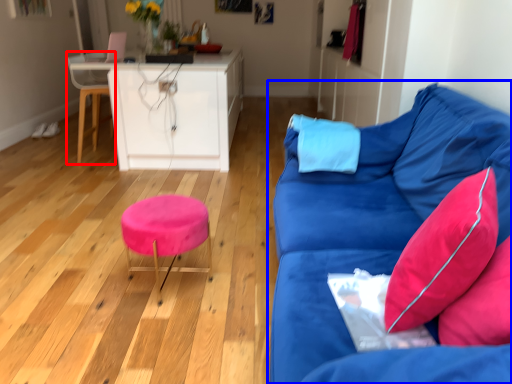
Question: Which object is closer to the camera taking this photo, swivel chair (highlighted by a red box) or studio couch (highlighted by a blue box)?

Choices:
 (A) swivel chair
 (B) studio couch

Answer: (B)